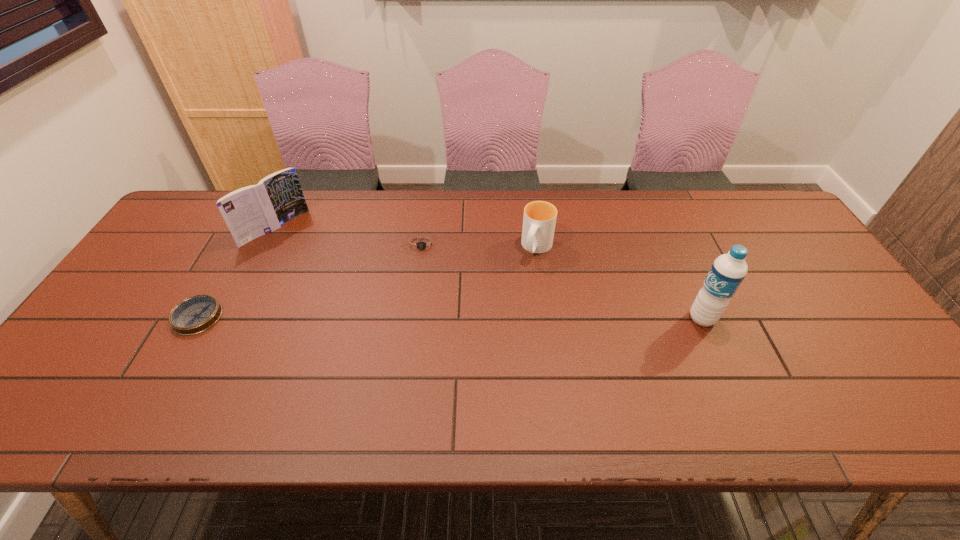
Where is `free space on the desktop that is between the shortest object and the tallest object and is positioned on the face of the third object from right to left`? Image resolution: width=960 pixels, height=540 pixels. free space on the desktop that is between the shortest object and the tallest object and is positioned on the face of the third object from right to left is located at coordinates (424, 318).

Where is `free spot on the desktop that is between the shortest object and the water bottle and is positioned with the handle on the side of the third shortest object`? free spot on the desktop that is between the shortest object and the water bottle and is positioned with the handle on the side of the third shortest object is located at coordinates (506, 318).

Image resolution: width=960 pixels, height=540 pixels. Find the location of `free space on the desktop that is between the compass and the water bottle and is positioned on the front cover of the book`. free space on the desktop that is between the compass and the water bottle and is positioned on the front cover of the book is located at coordinates (383, 318).